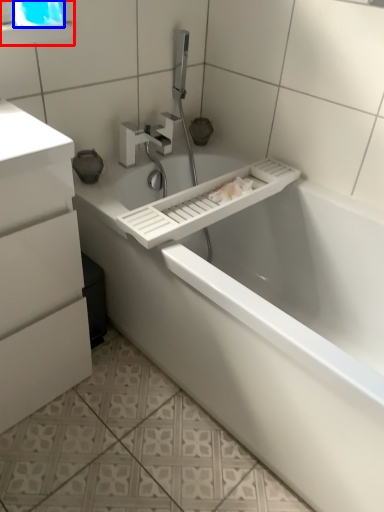
Question: Among these objects, which one is nearest to the camera, medicine cabinet (highlighted by a red box) or window screen (highlighted by a blue box)?

Choices:
 (A) medicine cabinet
 (B) window screen

Answer: (B)